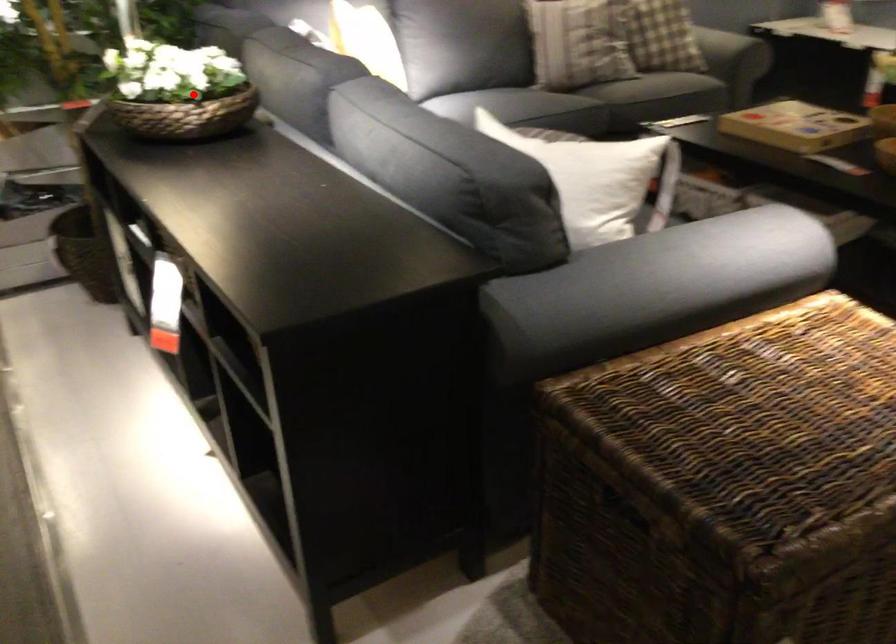
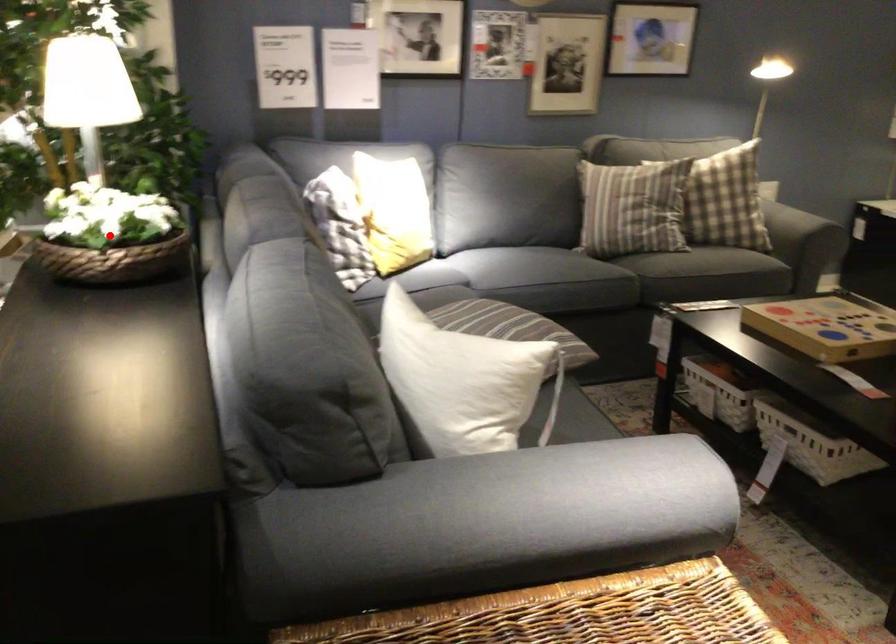
I am providing you with two images of the same scene from different viewpoints. A red point is marked on the first image and another point is marked on the second image. Is the red point in image1 aligned with the point shown in image2?

Yes